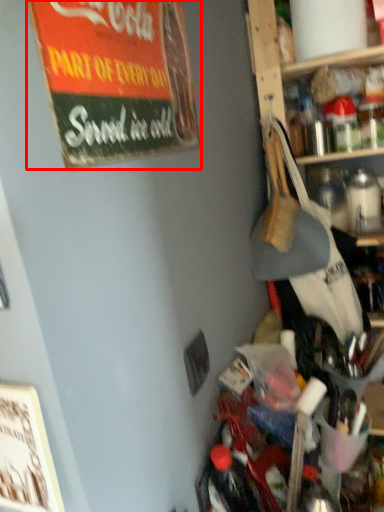
Question: From the image's perspective, what is the correct spatial positioning of bulletin board (annotated by the red box) in reference to bottle?

Choices:
 (A) below
 (B) above

Answer: (A)